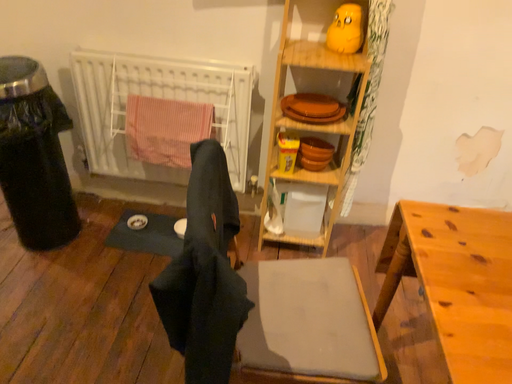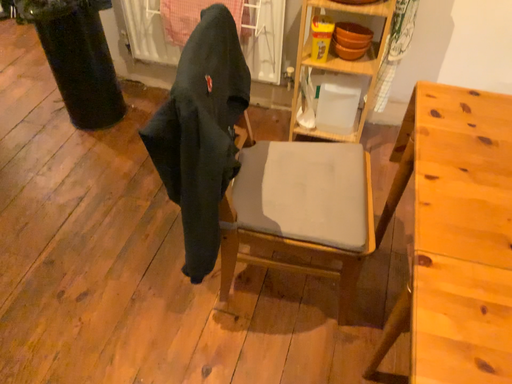
Question: Which way did the camera rotate in the video?

Choices:
 (A) rotated downward
 (B) rotated upward

Answer: (A)